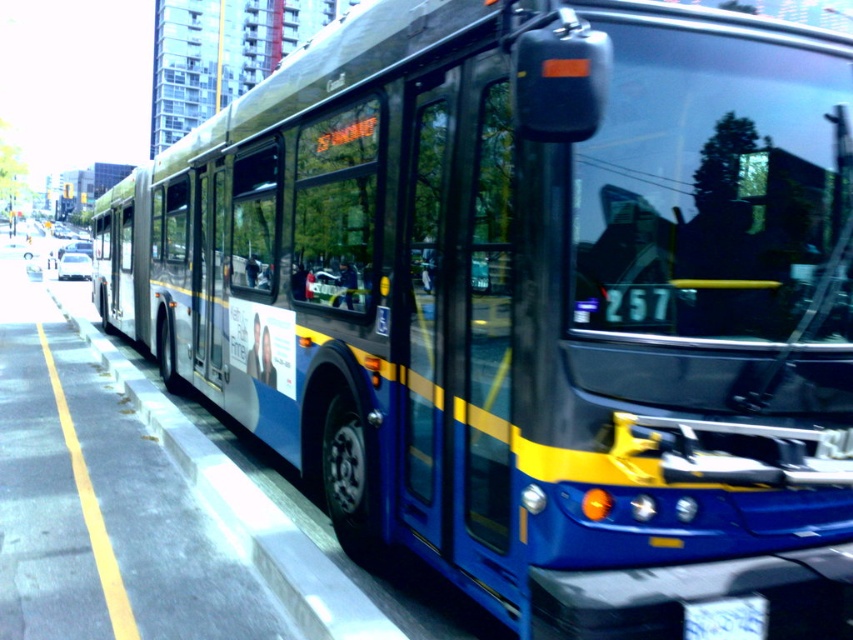
You are a delivery person who needs to park your van 6 feet away from the white plastic license plate at center. Can you park your van at the concrete curb at lower left?

The distance between the concrete curb at lower left and the white plastic license plate at center is 6.42 feet, which is slightly more than 6 feet. Therefore, parking at the concrete curb at lower left would satisfy the requirement of being 6 feet away from the white plastic license plate at center.